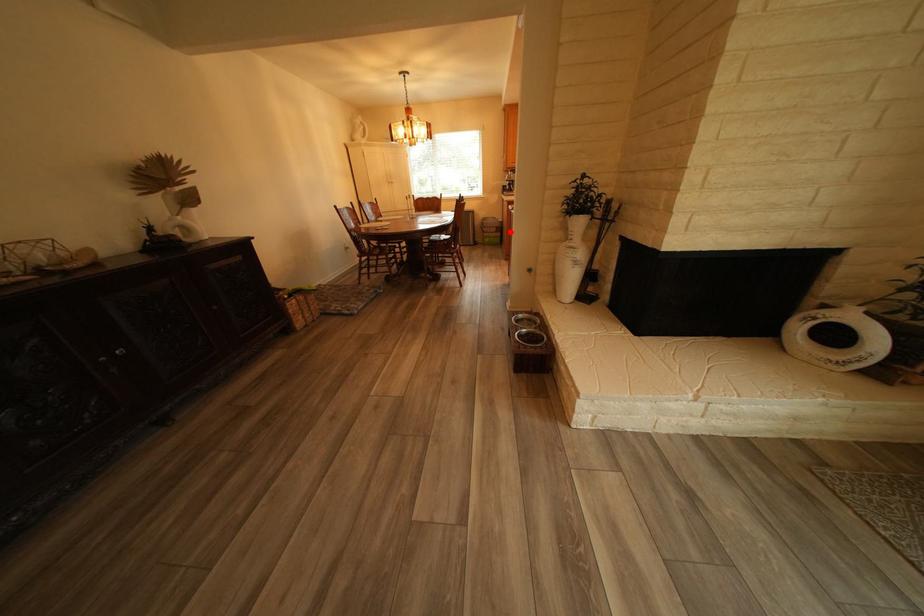
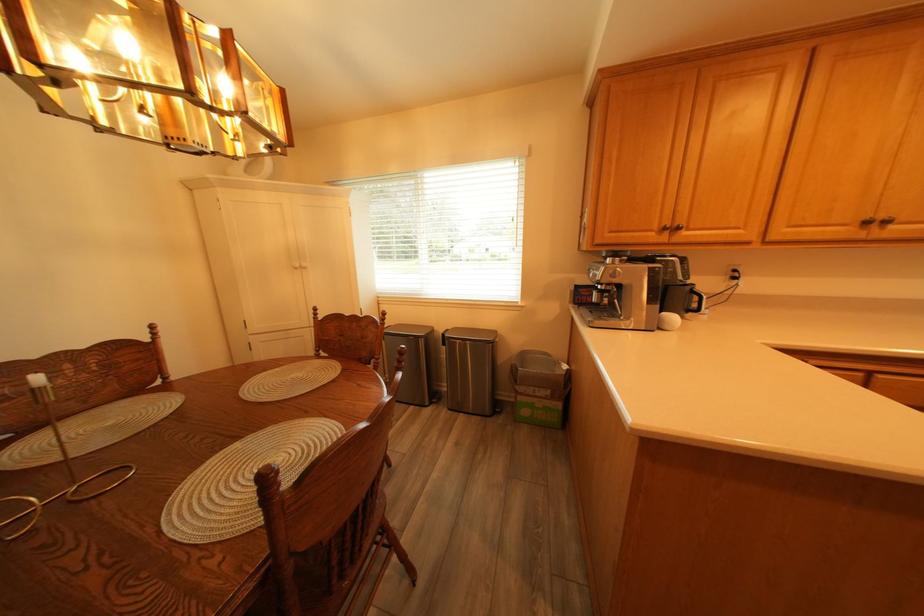
Question: A red point is marked in image1. In image2, is the corresponding 3D point closer to the camera or farther? Reply with the corresponding letter.

Choices:
 (A) The corresponding 3D point is closer.
 (B) The corresponding 3D point is farther.

Answer: (B)